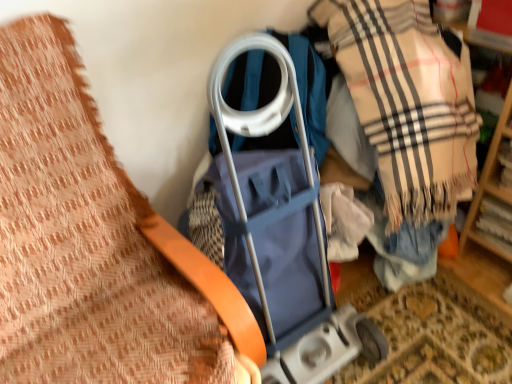
Question: From a real-world perspective, is orange leather belt at upper left positioned above or below blue fabric baby carriage at center?

Choices:
 (A) below
 (B) above

Answer: (B)

Question: Considering the relative positions of orange leather belt at upper left and blue fabric baby carriage at center in the image provided, is orange leather belt at upper left to the left or to the right of blue fabric baby carriage at center?

Choices:
 (A) right
 (B) left

Answer: (B)

Question: Which object is positioned closest to the blue fabric baby carriage at center?

Choices:
 (A) beige plaid scarf at center right
 (B) orange leather belt at upper left

Answer: (B)

Question: Considering the real-world distances, which object is farthest from the orange leather belt at upper left?

Choices:
 (A) blue fabric baby carriage at center
 (B) beige plaid scarf at center right

Answer: (B)